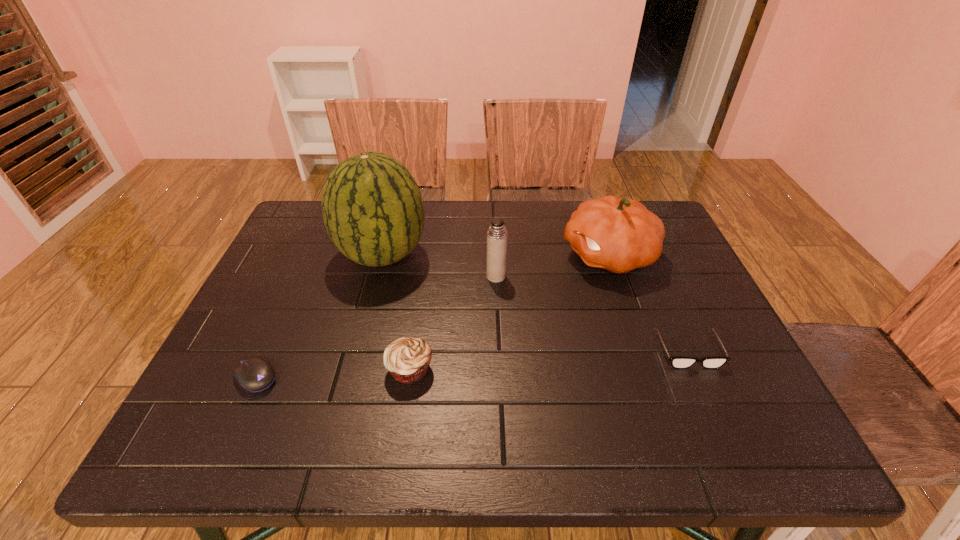
In order to click on the tallest object in this screenshot , I will do `click(372, 208)`.

Locate an element on the screen. The width and height of the screenshot is (960, 540). pumpkin is located at coordinates (619, 235).

This screenshot has height=540, width=960. In order to click on thermos bottle in this screenshot , I will do `click(497, 235)`.

The width and height of the screenshot is (960, 540). I want to click on muffin, so click(407, 359).

Image resolution: width=960 pixels, height=540 pixels. Find the location of `spectacles`. spectacles is located at coordinates (677, 362).

Find the location of a particular element. computer mouse is located at coordinates pyautogui.click(x=254, y=374).

You are a GUI agent. You are given a task and a screenshot of the screen. Output one action in this format:
    pyautogui.click(x=<x>, y=<y>)
    Task: Click on the free space located 0.110m on the right of the tallest object
    
    Given the screenshot: What is the action you would take?
    pyautogui.click(x=468, y=254)

The height and width of the screenshot is (540, 960). What are the coordinates of `free space located on the front face of the pumpkin` in the screenshot? It's located at pyautogui.click(x=490, y=255).

Find the location of a particular element. Image resolution: width=960 pixels, height=540 pixels. vacant space situated 0.380m on the front face of the pumpkin is located at coordinates (425, 255).

Find the location of `vacant space located on the front face of the pumpkin`. vacant space located on the front face of the pumpkin is located at coordinates (436, 255).